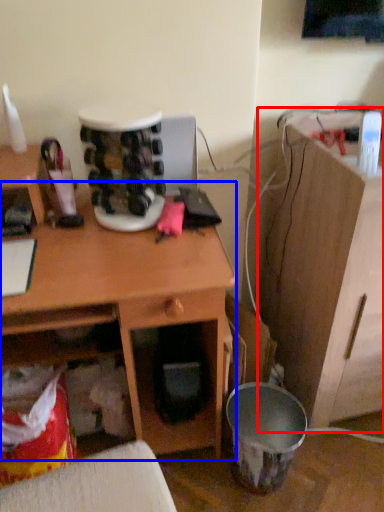
Question: Which object appears closest to the camera in this image, computer desk (highlighted by a red box) or desk (highlighted by a blue box)?

Choices:
 (A) computer desk
 (B) desk

Answer: (B)